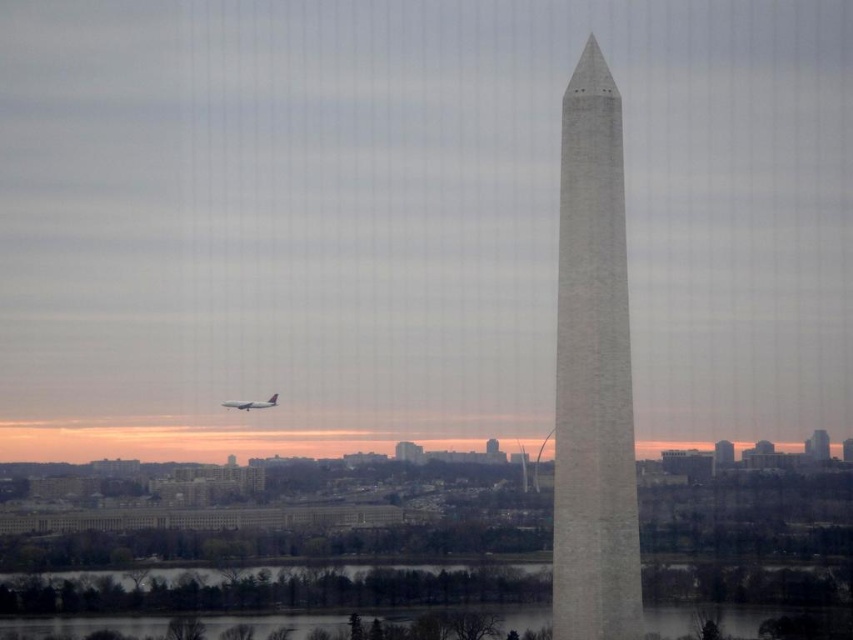
Between white stone tower at center and metallic silver airplane at lower left, which one is positioned lower?

metallic silver airplane at lower left is below.

Who is more forward, (616, 305) or (271, 406)?

Positioned in front is point (271, 406).

Who is more distant from viewer, (x=599, y=109) or (x=262, y=403)?

The point (x=599, y=109) is behind.

Locate an element on the screen. white stone tower at center is located at coordinates (593, 372).